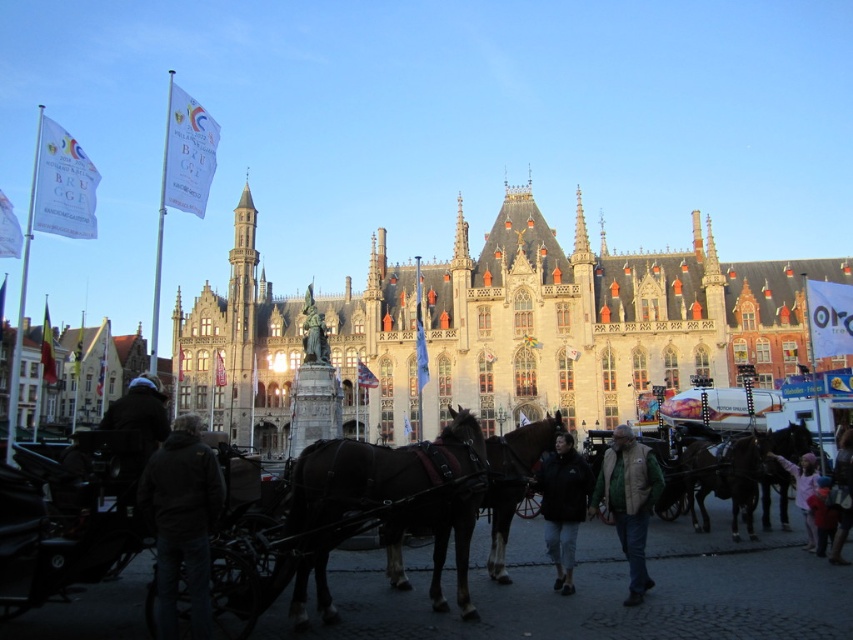
Question: Which point is closer to the camera?

Choices:
 (A) (798, 492)
 (B) (402, 456)
 (C) (184, 552)

Answer: (C)

Question: Is shiny dark brown horse at center positioned before shiny brown horse at center?

Choices:
 (A) no
 (B) yes

Answer: (B)

Question: Which point is closer to the camera taking this photo?

Choices:
 (A) (436, 486)
 (B) (734, 461)

Answer: (A)

Question: Which is nearer to the stone gothic building at center?

Choices:
 (A) khaki fabric jacket at center
 (B) dark blue jacket at center
 (C) dark gray jacket at lower left

Answer: (A)

Question: Can you confirm if stone gothic building at center is positioned to the right of shiny brown horse at center?

Choices:
 (A) yes
 (B) no

Answer: (B)

Question: Does shiny brown horse at center have a smaller size compared to pink fabric at center?

Choices:
 (A) no
 (B) yes

Answer: (A)